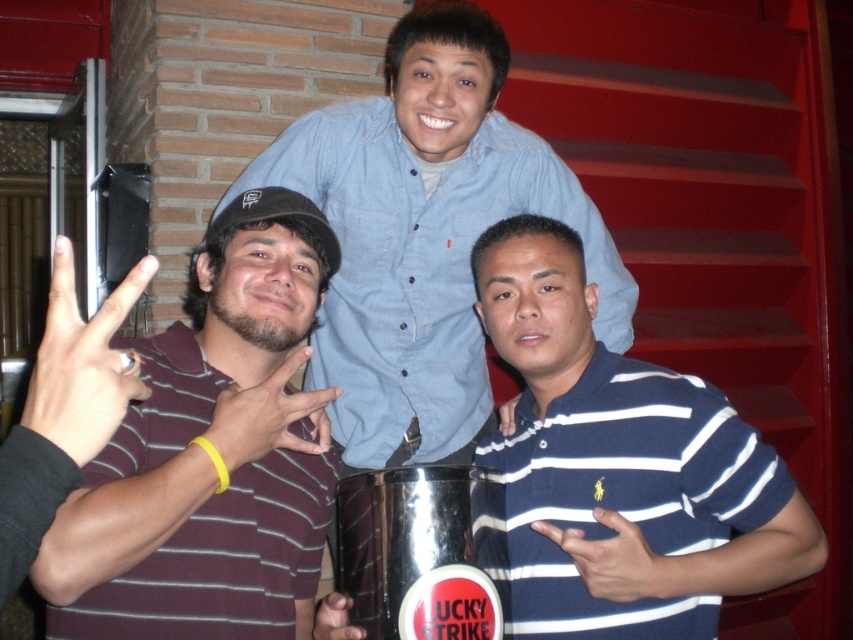
You are a photographer at the event and want to capture a closeup of the maroon striped shirt at center and the shiny metallic can at center in the same frame. The camera has a minimum focusing distance of 9 inches. Can you take the photo without moving either object?

The maroon striped shirt at center is 8.85 inches away from the shiny metallic can at center. Since the minimum focusing distance is 9 inches, the camera cannot focus on both objects simultaneously because they are closer than the required distance. You will need to move either the shirt or the can to increase the distance between them.

What is located at the coordinates point [212,454]?

The maroon striped shirt at center is located at point [212,454].

You are at a social event and want to take a photo of the maroon striped shirt at center and the blue striped polo shirt at center. Which one should you focus on first if you want to capture both in the frame without moving the camera?

The maroon striped shirt at center is much taller than the blue striped polo shirt at center, so you should focus on the maroon striped shirt at center first to ensure it fits within the frame.